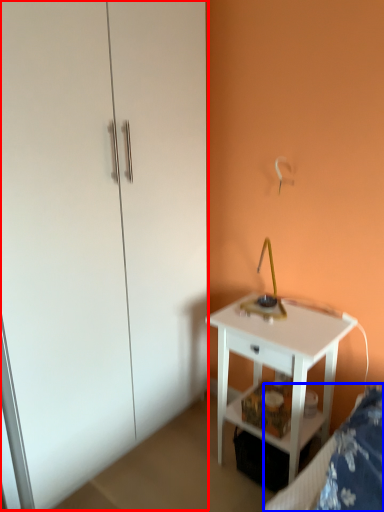
Question: Which of the following is the closest to the observer, dresser (highlighted by a red box) or bed frame (highlighted by a blue box)?

Choices:
 (A) dresser
 (B) bed frame

Answer: (B)